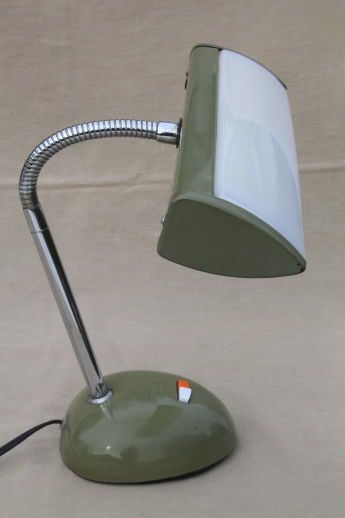
I want to click on chrome pole, so click(75, 334), click(60, 296).